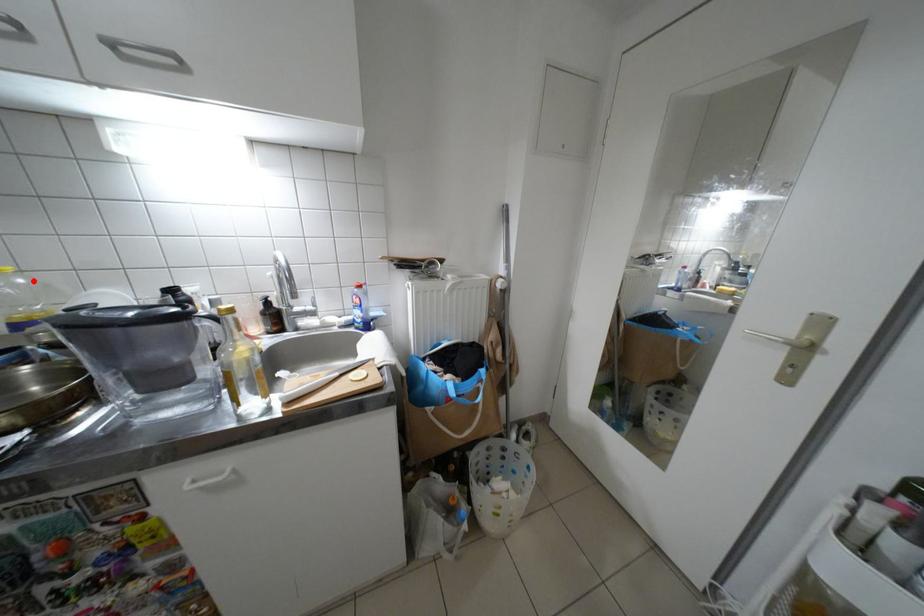
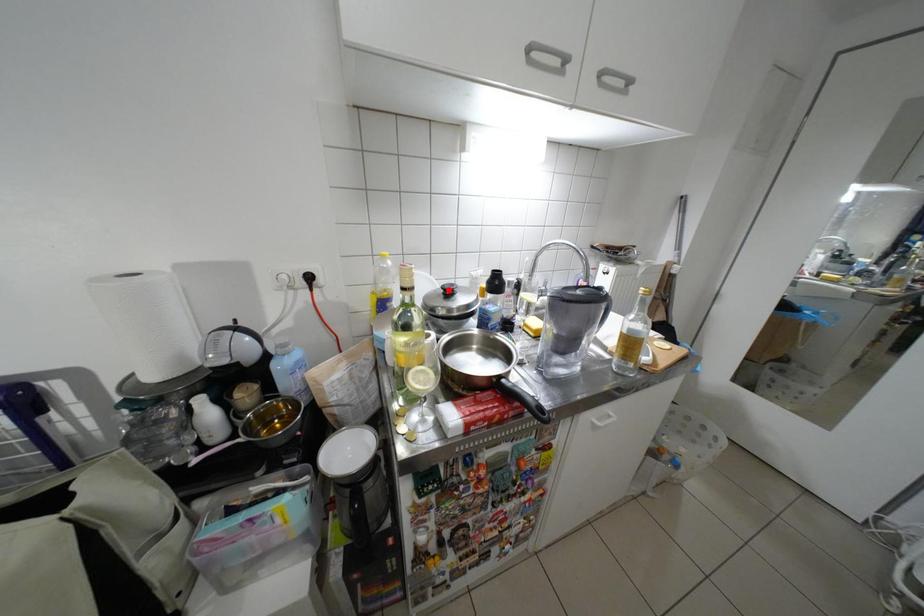
I am providing you with two images of the same scene from different viewpoints. A red point is marked on the first image and another point is marked on the second image. Are the points marked in image1 and image2 representing the same 3D position?

No